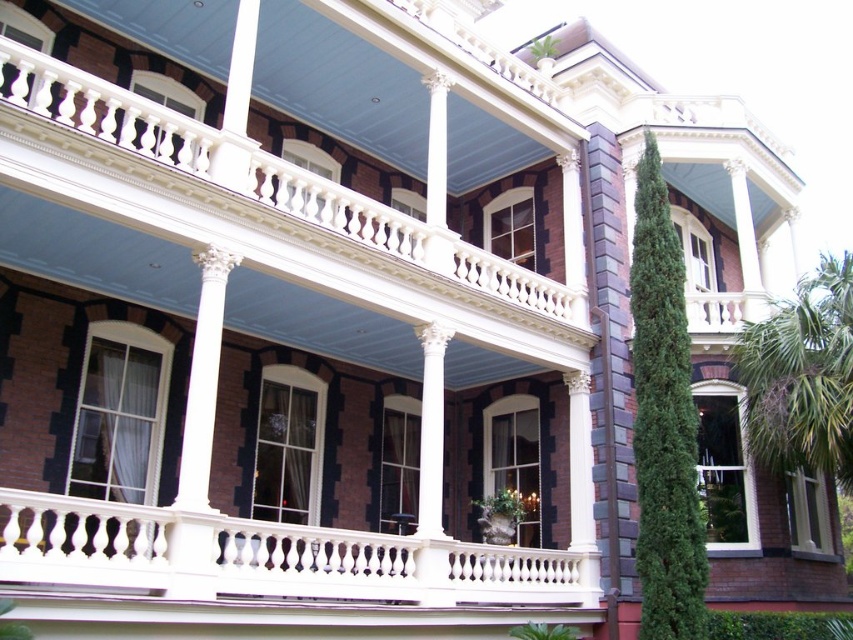
Looking at this image, you are standing in front of the Victorian house and want to know if the green textured cypress tree at right is positioned higher up than the white marble column at center. Can you determine this based on the scene?

The green textured cypress tree at right is located above the white marble column at center, so yes, it is positioned higher up.

You are a window cleaner standing on the ground in front of the Victorian house. You need to clean both the white polished wood balustrade at center and the green textured cypress tree at right. Which object will require you to use a taller ladder?

The white polished wood balustrade at center is larger in size than the green textured cypress tree at right, so you will need a taller ladder to reach the white polished wood balustrade at center.